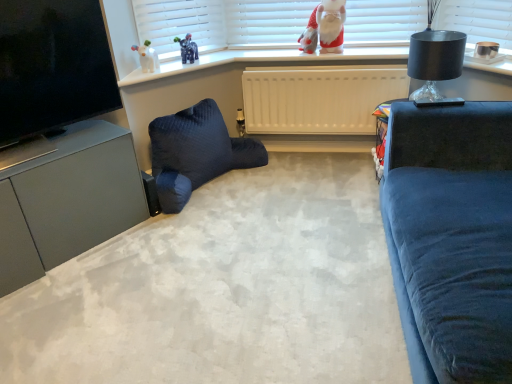
Measure the distance between black glass lamp at upper right and camera.

They are 1.83 meters apart.

Measure the distance between matte black tv at left and camera.

matte black tv at left and camera are 1.57 meters apart from each other.

You are a GUI agent. You are given a task and a screenshot of the screen. Output one action in this format:
    pyautogui.click(x=<x>, y=<y>)
    Task: Click on the white matte radiator at center
    This screenshot has width=512, height=384.
    Given the screenshot: What is the action you would take?
    pyautogui.click(x=319, y=98)

This screenshot has width=512, height=384. Describe the element at coordinates (319, 98) in the screenshot. I see `white matte radiator at center` at that location.

You are a GUI agent. You are given a task and a screenshot of the screen. Output one action in this format:
    pyautogui.click(x=<x>, y=<y>)
    Task: Click on the satin grey cabinet at lower left
    This screenshot has width=512, height=384.
    Given the screenshot: What is the action you would take?
    pyautogui.click(x=68, y=201)

What do you see at coordinates (147, 57) in the screenshot?
I see `white glossy elephant at upper left` at bounding box center [147, 57].

Locate an element on the screen. Image resolution: width=512 pixels, height=384 pixels. black glass lamp at upper right is located at coordinates (435, 60).

Does dark blue quilted bean bag chair at lower left contain matte black tv at left?

No, matte black tv at left is not a part of dark blue quilted bean bag chair at lower left.

In terms of size, does dark blue quilted bean bag chair at lower left appear bigger or smaller than matte black tv at left?

Clearly, dark blue quilted bean bag chair at lower left is larger in size than matte black tv at left.

Locate an element on the screen. This screenshot has width=512, height=384. bean bag chair on the right of matte black tv at left is located at coordinates (196, 152).

Looking at this image, does dark blue quilted bean bag chair at lower left have a greater width compared to matte black tv at left?

Yes, dark blue quilted bean bag chair at lower left is wider than matte black tv at left.

Which object is further away from the camera, black glass lamp at upper right or matte black tv at left?

black glass lamp at upper right.

Does point (412, 38) come behind point (20, 52)?

Yes, point (412, 38) is farther from viewer.

Is black glass lamp at upper right not within matte black tv at left?

Yes, black glass lamp at upper right is located beyond the bounds of matte black tv at left.

In terms of size, does black glass lamp at upper right appear bigger or smaller than matte black tv at left?

In the image, black glass lamp at upper right appears to be smaller than matte black tv at left.

Could you tell me if white glossy elephant at upper left is turned towards satin grey cabinet at lower left?

No, white glossy elephant at upper left does not turn towards satin grey cabinet at lower left.

From the image's perspective, is white glossy elephant at upper left over satin grey cabinet at lower left?

Correct, white glossy elephant at upper left appears higher than satin grey cabinet at lower left in the image.

Based on the photo, from a real-world perspective, is white glossy elephant at upper left under satin grey cabinet at lower left?

No, from a real-world perspective, white glossy elephant at upper left is not beneath satin grey cabinet at lower left.

Does dark blue quilted bean bag chair at lower left have a lesser height compared to red plush santa at upper center?

In fact, dark blue quilted bean bag chair at lower left may be taller than red plush santa at upper center.

Is red plush santa at upper center inside dark blue quilted bean bag chair at lower left?

No, red plush santa at upper center is not inside dark blue quilted bean bag chair at lower left.

Is dark blue quilted bean bag chair at lower left oriented towards red plush santa at upper center?

No, dark blue quilted bean bag chair at lower left is not oriented towards red plush santa at upper center.

There is a dark blue quilted bean bag chair at lower left. At what (x,y) coordinates should I click in order to perform the action: click on doll above it (from a real-world perspective). Please return your answer as a coordinate pair (x, y). Looking at the image, I should click on (325, 28).

Considering the relative sizes of black glass lamp at upper right and dark blue quilted bean bag chair at lower left in the image provided, is black glass lamp at upper right shorter than dark blue quilted bean bag chair at lower left?

Yes, black glass lamp at upper right is shorter than dark blue quilted bean bag chair at lower left.

Does point (414, 50) lie in front of point (223, 151)?

Yes, point (414, 50) is closer to viewer.

What's the angular difference between black glass lamp at upper right and dark blue quilted bean bag chair at lower left's facing directions?

black glass lamp at upper right and dark blue quilted bean bag chair at lower left are facing 139 degrees away from each other.

Is black glass lamp at upper right wider than dark blue quilted bean bag chair at lower left?

Incorrect, the width of black glass lamp at upper right does not surpass that of dark blue quilted bean bag chair at lower left.

Is white glossy window sill at upper center positioned beyond the bounds of satin grey cabinet at lower left?

Absolutely, white glossy window sill at upper center is external to satin grey cabinet at lower left.

From the image's perspective, which object appears higher, white glossy window sill at upper center or satin grey cabinet at lower left?

white glossy window sill at upper center, from the image's perspective.

Looking at this image, considering the sizes of objects white glossy window sill at upper center and satin grey cabinet at lower left in the image provided, who is taller, white glossy window sill at upper center or satin grey cabinet at lower left?

Standing taller between the two is satin grey cabinet at lower left.

You are a GUI agent. You are given a task and a screenshot of the screen. Output one action in this format:
    pyautogui.click(x=<x>, y=<y>)
    Task: Click on the window sill on the right of satin grey cabinet at lower left
    
    Given the screenshot: What is the action you would take?
    pyautogui.click(x=263, y=60)

Which of these two, black glass lamp at upper right or white matte radiator at center, stands taller?

With more height is white matte radiator at center.

In the image, is black glass lamp at upper right on the left side or the right side of white matte radiator at center?

Based on their positions, black glass lamp at upper right is located to the right of white matte radiator at center.

From the image's perspective, is black glass lamp at upper right located beneath white matte radiator at center?

Incorrect, from the image's perspective, black glass lamp at upper right is higher than white matte radiator at center.

Does point (433, 73) appear closer or farther from the camera than point (306, 127)?

Point (433, 73) appears to be closer to the viewer than point (306, 127).

The image size is (512, 384). Find the location of `bean bag chair below the matte black tv at left (from a real-world perspective)`. bean bag chair below the matte black tv at left (from a real-world perspective) is located at coordinates (196, 152).

In order to click on television lying below the black glass lamp at upper right (from the image's perspective) in this screenshot , I will do coord(53,66).

Consider the image. Which object lies nearer to the anchor point satin grey cabinet at lower left, white glossy window sill at upper center or white glossy elephant at upper left?

white glossy window sill at upper center is positioned closer to the anchor satin grey cabinet at lower left.

When comparing their distances from dark blue quilted bean bag chair at lower left, does white glossy elephant at upper left or matte black tv at left seem further?

matte black tv at left is positioned further to the anchor dark blue quilted bean bag chair at lower left.

Estimate the real-world distances between objects in this image. Which object is further from black glass lamp at upper right, white matte radiator at center or white glossy window sill at upper center?

Among the two, white glossy window sill at upper center is located further to black glass lamp at upper right.

From the picture: When comparing their distances from white matte radiator at center, does white glossy window sill at upper center or dark blue quilted bean bag chair at lower left seem further?

dark blue quilted bean bag chair at lower left is further to white matte radiator at center.

Based on their spatial positions, is satin grey cabinet at lower left or dark blue quilted bean bag chair at lower left further from white matte radiator at center?

satin grey cabinet at lower left lies further to white matte radiator at center than the other object.

Estimate the real-world distances between objects in this image. Which object is further from white glossy elephant at upper left, satin grey cabinet at lower left or black glass lamp at upper right?

Among the two, black glass lamp at upper right is located further to white glossy elephant at upper left.

Based on their spatial positions, is white glossy window sill at upper center or satin grey cabinet at lower left closer to red plush santa at upper center?

Among the two, white glossy window sill at upper center is located nearer to red plush santa at upper center.

Looking at the image, which one is located closer to matte black tv at left, white glossy window sill at upper center or white glossy elephant at upper left?

white glossy window sill at upper center is closer to matte black tv at left.

Where is `bean bag chair between white glossy elephant at upper left and white glossy window sill at upper center`? Image resolution: width=512 pixels, height=384 pixels. bean bag chair between white glossy elephant at upper left and white glossy window sill at upper center is located at coordinates (196, 152).

This screenshot has height=384, width=512. In order to click on toy located between satin grey cabinet at lower left and white glossy window sill at upper center in the left-right direction in this screenshot , I will do `click(147, 57)`.

In order to click on toy between satin grey cabinet at lower left and white matte radiator at center in the horizontal direction in this screenshot , I will do `click(147, 57)`.

Locate an element on the screen. window sill between matte black tv at left and white matte radiator at center from left to right is located at coordinates (263, 60).